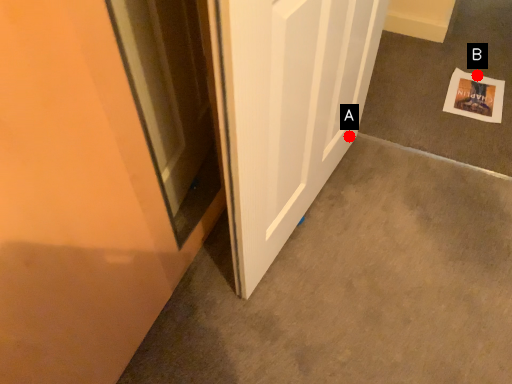
Question: Two points are circled on the image, labeled by A and B beside each circle. Among these points, which one is nearest to the camera?

Choices:
 (A) A is closer
 (B) B is closer

Answer: (A)